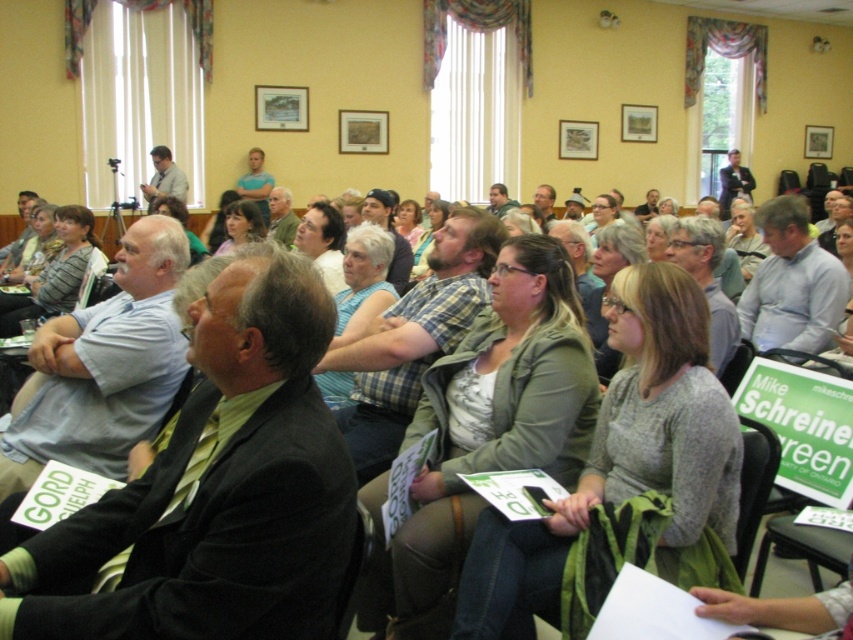
You are organizing a photo shoot in the conference room and need to position two models wearing the green fabric jacket at center and the matte green sweater at center. If you want to place them side by side, which model should stand on the left to avoid overlapping?

The model wearing the green fabric jacket at center should stand on the left because it might be wider than the matte green sweater at center, allowing more space between them.

Where is the white shirt at center located in the image?

The white shirt at center is located at the 2D coordinates point (791, 284) in the image.